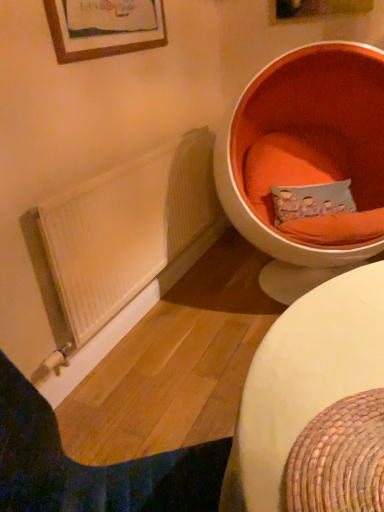
Question: Is white woven table at lower right completely or partially inside orange fabric pillow at upper right?

Choices:
 (A) yes
 (B) no

Answer: (B)

Question: Is orange fabric pillow at upper right further to camera compared to white woven table at lower right?

Choices:
 (A) yes
 (B) no

Answer: (A)

Question: Does orange fabric pillow at upper right have a smaller size compared to white woven table at lower right?

Choices:
 (A) no
 (B) yes

Answer: (A)

Question: Does orange fabric pillow at upper right have a greater width compared to white woven table at lower right?

Choices:
 (A) no
 (B) yes

Answer: (A)

Question: Can you confirm if orange fabric pillow at upper right is bigger than white woven table at lower right?

Choices:
 (A) no
 (B) yes

Answer: (B)

Question: Does point pyautogui.click(x=216, y=479) appear closer or farther from the camera than point pyautogui.click(x=296, y=151)?

Choices:
 (A) farther
 (B) closer

Answer: (B)

Question: Considering the positions of white wood radiator at lower left and orange fabric at right in the image, is white wood radiator at lower left taller or shorter than orange fabric at right?

Choices:
 (A) short
 (B) tall

Answer: (A)

Question: Visually, is white wood radiator at lower left positioned to the left or to the right of orange fabric at right?

Choices:
 (A) right
 (B) left

Answer: (B)

Question: In terms of size, does white wood radiator at lower left appear bigger or smaller than orange fabric at right?

Choices:
 (A) small
 (B) big

Answer: (A)

Question: From a real-world perspective, is orange fabric at right above or below white wood radiator at lower left?

Choices:
 (A) above
 (B) below

Answer: (A)

Question: Based on their sizes in the image, would you say orange fabric at right is bigger or smaller than white wood radiator at lower left?

Choices:
 (A) big
 (B) small

Answer: (A)

Question: Do you think orange fabric at right is within white wood radiator at lower left, or outside of it?

Choices:
 (A) outside
 (B) inside

Answer: (A)

Question: Is orange fabric at right taller or shorter than white wood radiator at lower left?

Choices:
 (A) short
 (B) tall

Answer: (B)

Question: From a real-world perspective, relative to orange fabric pillow at upper right, is white woven table at lower right vertically above or below?

Choices:
 (A) below
 (B) above

Answer: (B)

Question: From the image's perspective, is white woven table at lower right located above or below orange fabric pillow at upper right?

Choices:
 (A) above
 (B) below

Answer: (B)